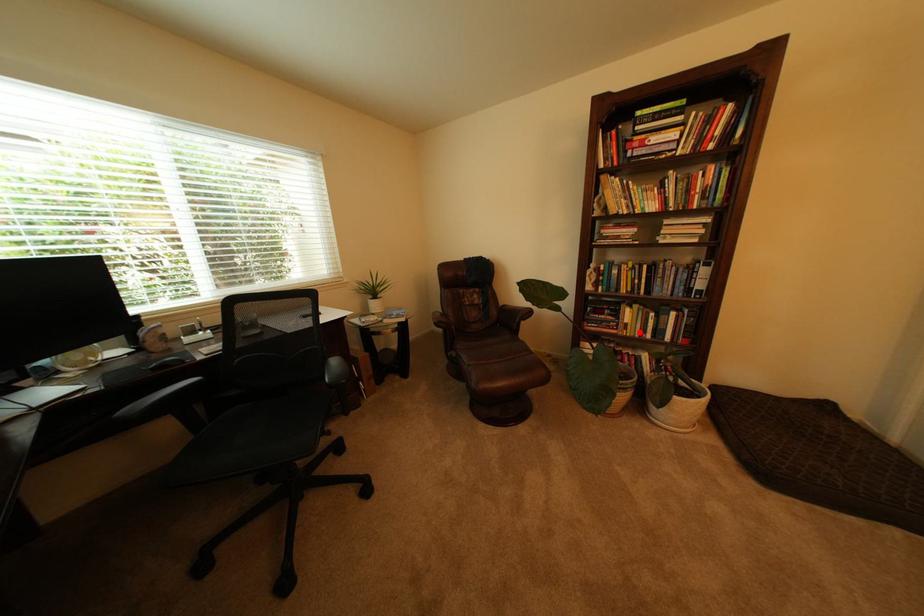
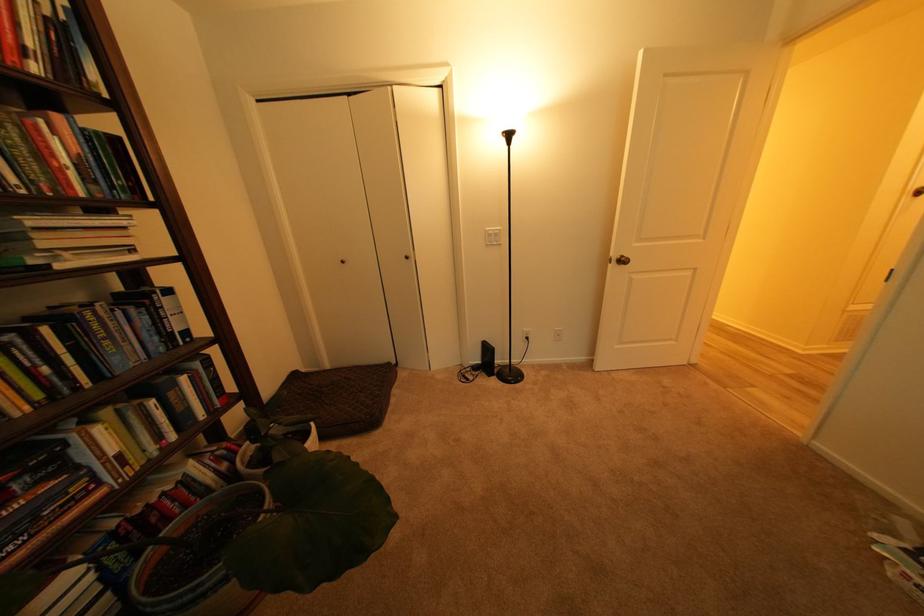
In the second image, find the point that corresponds to the highlighted location in the first image.

(141, 463)